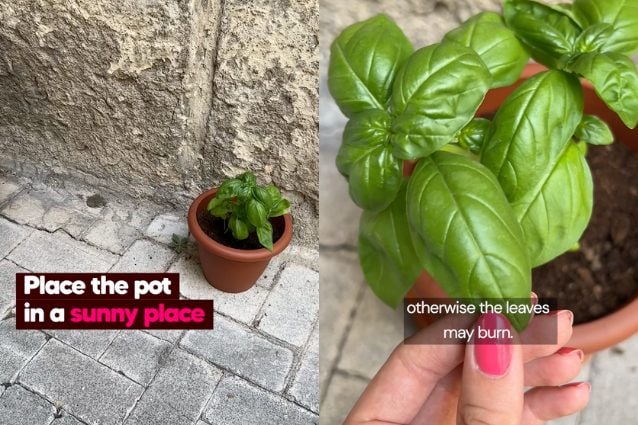
The image size is (638, 425). I want to click on plant, so (441, 146), (579, 72), (238, 195).